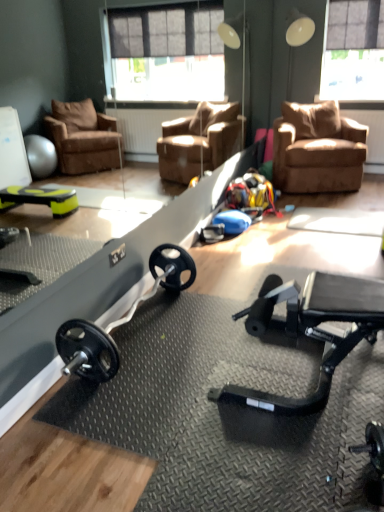
Question: In terms of width, does translucent plastic window screen at upper right look wider or thinner when compared to brown suede chair at upper right?

Choices:
 (A) wide
 (B) thin

Answer: (B)

Question: From a real-world perspective, is translucent plastic window screen at upper right physically located above or below brown suede chair at upper right?

Choices:
 (A) below
 (B) above

Answer: (B)

Question: Which of these objects is positioned farthest from the brown suede chair at upper right?

Choices:
 (A) translucent plastic window screen at upper right
 (B) black rubber barbell at center

Answer: (B)

Question: Estimate the real-world distances between objects in this image. Which object is closer to the black rubber barbell at center?

Choices:
 (A) brown suede chair at upper right
 (B) translucent plastic window screen at upper right

Answer: (A)